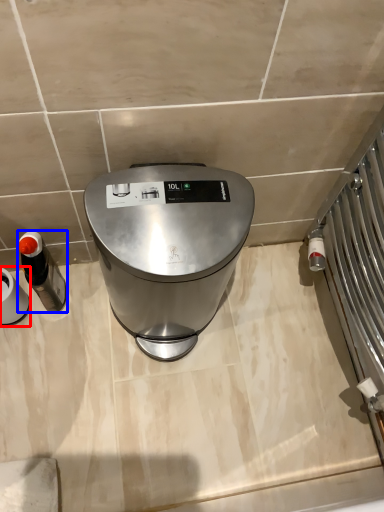
Question: Among these objects, which one is nearest to the camera, appliance (highlighted by a red box) or appliance (highlighted by a blue box)?

Choices:
 (A) appliance
 (B) appliance

Answer: (A)